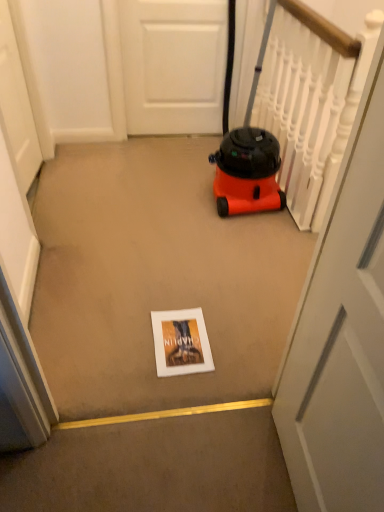
Question: Are white matte door at left, which is the second door in front-to-back order, and matte white book at center far apart?

Choices:
 (A) yes
 (B) no

Answer: (A)

Question: Does white matte door at left, which is the second door in front-to-back order, have a lesser width compared to matte white book at center?

Choices:
 (A) yes
 (B) no

Answer: (A)

Question: Considering the relative sizes of white matte door at left, the first door from the left, and matte white book at center in the image provided, is white matte door at left, the first door from the left, taller than matte white book at center?

Choices:
 (A) yes
 (B) no

Answer: (A)

Question: Is white matte door at left, which is the second door in front-to-back order, aimed at matte white book at center?

Choices:
 (A) no
 (B) yes

Answer: (A)

Question: From a real-world perspective, does white matte door at left, positioned as the 3th door in right-to-left order, sit lower than matte white book at center?

Choices:
 (A) yes
 (B) no

Answer: (B)

Question: Considering the relative positions of white matte door at upper center, the 3th door viewed from the front, and white matte door at left, which is the second door in front-to-back order, in the image provided, is white matte door at upper center, the 3th door viewed from the front, to the left or to the right of white matte door at left, which is the second door in front-to-back order,?

Choices:
 (A) left
 (B) right

Answer: (B)

Question: Is white matte door at upper center, the second door positioned from the left, wider or thinner than white matte door at left, positioned as the 3th door in right-to-left order?

Choices:
 (A) wide
 (B) thin

Answer: (B)

Question: Is white matte door at upper center, marked as the 2th door in a right-to-left arrangement, taller or shorter than white matte door at left, which is the second door in front-to-back order?

Choices:
 (A) tall
 (B) short

Answer: (B)

Question: Is white matte door at upper center, marked as the 2th door in a right-to-left arrangement, in front of or behind white matte door at left, which is the second door in front-to-back order, in the image?

Choices:
 (A) behind
 (B) front

Answer: (A)

Question: Visually, is white matte door at upper center, the second door positioned from the left, positioned to the left or to the right of orange matte vacuum cleaner at center-right?

Choices:
 (A) right
 (B) left

Answer: (B)

Question: Which is correct: white matte door at upper center, the first door viewed from the back, is inside orange matte vacuum cleaner at center-right, or outside of it?

Choices:
 (A) inside
 (B) outside

Answer: (B)

Question: Based on their sizes in the image, would you say white matte door at upper center, the 3th door viewed from the front, is bigger or smaller than orange matte vacuum cleaner at center-right?

Choices:
 (A) small
 (B) big

Answer: (A)

Question: From a real-world perspective, relative to orange matte vacuum cleaner at center-right, is white matte door at upper center, the 3th door viewed from the front, vertically above or below?

Choices:
 (A) below
 (B) above

Answer: (A)

Question: Does point (281, 439) appear closer or farther from the camera than point (243, 161)?

Choices:
 (A) farther
 (B) closer

Answer: (B)

Question: Considering the relative positions of white glossy door at center, arranged as the 1th door when viewed from the right, and orange matte vacuum cleaner at center-right in the image provided, is white glossy door at center, arranged as the 1th door when viewed from the right, to the left or to the right of orange matte vacuum cleaner at center-right?

Choices:
 (A) right
 (B) left

Answer: (A)